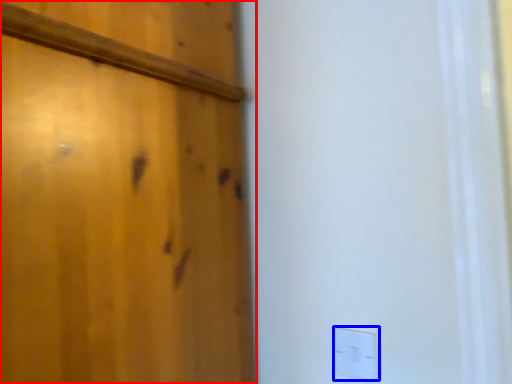
Question: Among these objects, which one is farthest to the camera, door (highlighted by a red box) or light switch (highlighted by a blue box)?

Choices:
 (A) door
 (B) light switch

Answer: (B)